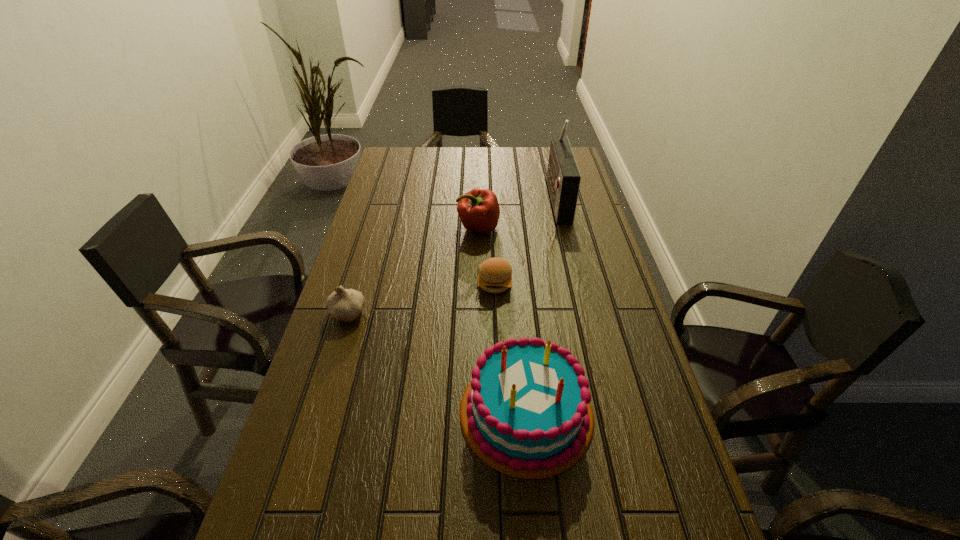
This screenshot has width=960, height=540. I want to click on free space at the left edge of the desktop, so click(378, 245).

Identify the location of vacant space at the right edge of the desktop. This screenshot has height=540, width=960. (568, 241).

Find the location of a particular element. The height and width of the screenshot is (540, 960). free spot between the shortest object and the third tallest object is located at coordinates (487, 256).

The height and width of the screenshot is (540, 960). What are the coordinates of `empty space between the radio receiver and the third tallest object` in the screenshot? It's located at (517, 213).

Locate an element on the screen. free space between the third tallest object and the radio receiver is located at coordinates (517, 213).

Where is `free spot between the third shortest object and the tallest object`? free spot between the third shortest object and the tallest object is located at coordinates (517, 213).

Where is `free spot between the tallest object and the garlic`? Image resolution: width=960 pixels, height=540 pixels. free spot between the tallest object and the garlic is located at coordinates (452, 256).

Locate an element on the screen. vacant space that's between the hamburger and the second nearest object is located at coordinates (421, 299).

Where is `empty location between the birthday cake and the second nearest object`? This screenshot has height=540, width=960. empty location between the birthday cake and the second nearest object is located at coordinates (437, 363).

The width and height of the screenshot is (960, 540). Find the location of `free point between the bell pepper and the shortest object`. free point between the bell pepper and the shortest object is located at coordinates (487, 256).